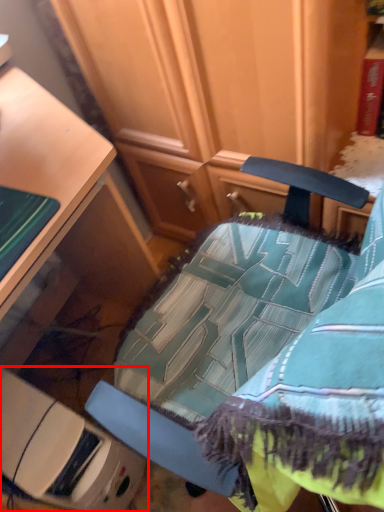
Question: Observing the image, what is the correct spatial positioning of furniture (annotated by the red box) in reference to chair?

Choices:
 (A) left
 (B) right

Answer: (A)